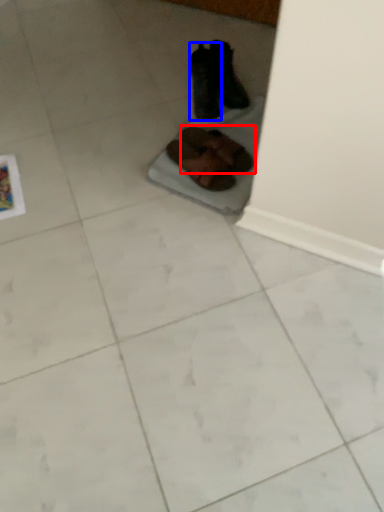
Question: Which of the following is the farthest to the observer, footwear (highlighted by a red box) or footwear (highlighted by a blue box)?

Choices:
 (A) footwear
 (B) footwear

Answer: (B)